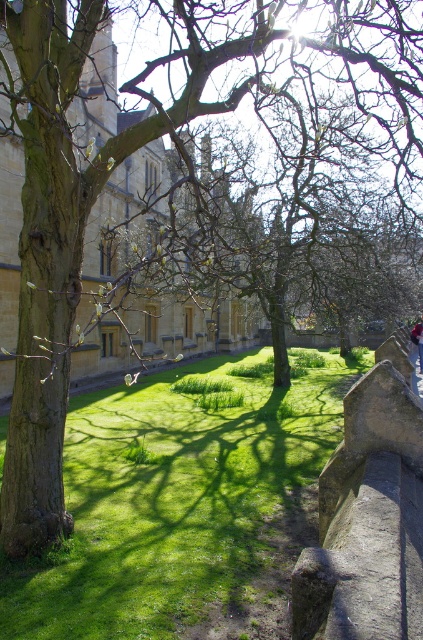
Which is in front, point (173, 634) or point (420, 362)?

Point (173, 634) is more forward.

Who is positioned more to the left, green grass at center or denim jacket at lower right?

Positioned to the left is green grass at center.

Does point (93, 472) come closer to viewer compared to point (415, 330)?

That is True.

At what (x,y) coordinates should I click in order to perform the action: click on green grass at center. Please return your answer as a coordinate pair (x, y). The height and width of the screenshot is (640, 423). Looking at the image, I should click on (180, 506).